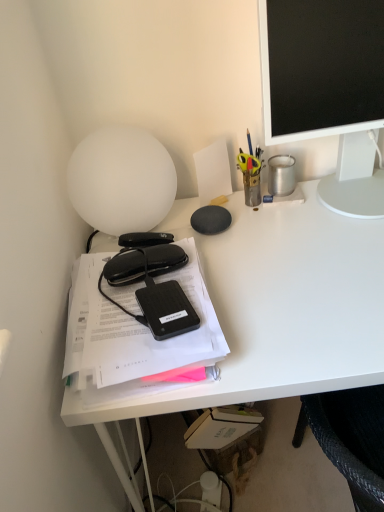
Find the location of a particular element. The width and height of the screenshot is (384, 512). free point in front of black matte glasses case at left, which appears as the 4th stationery when viewed from the back is located at coordinates (145, 362).